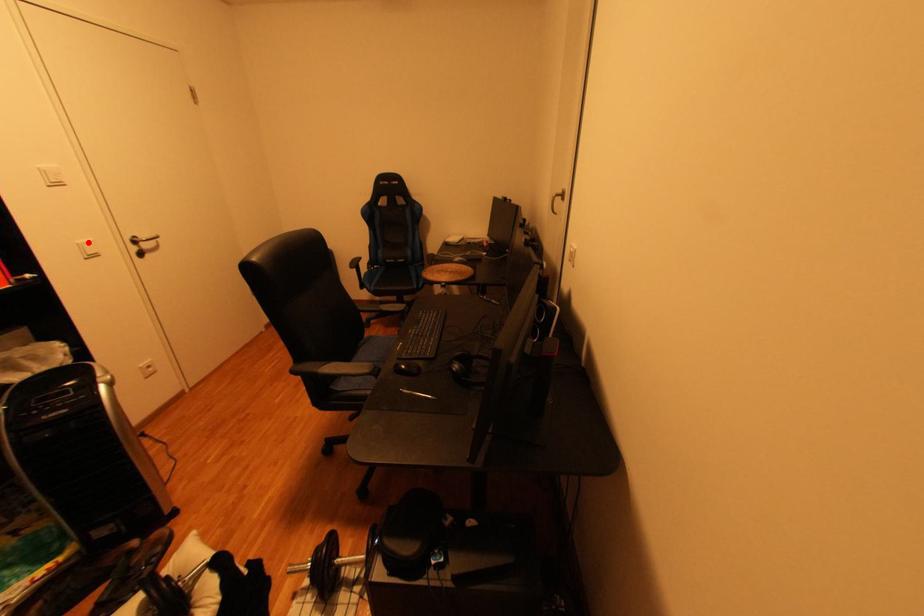
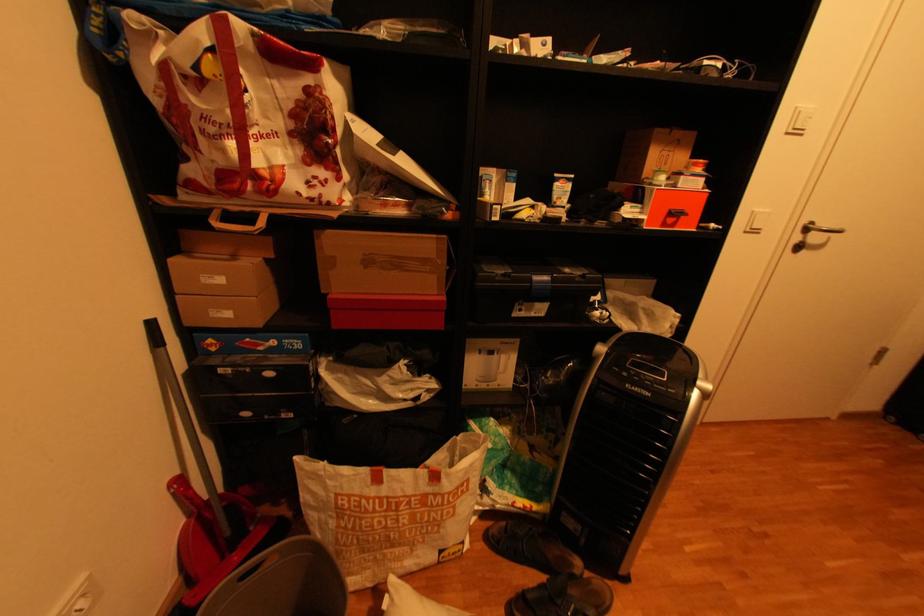
Locate, in the second image, the point that corresponds to the highlighted location in the first image.

(766, 209)